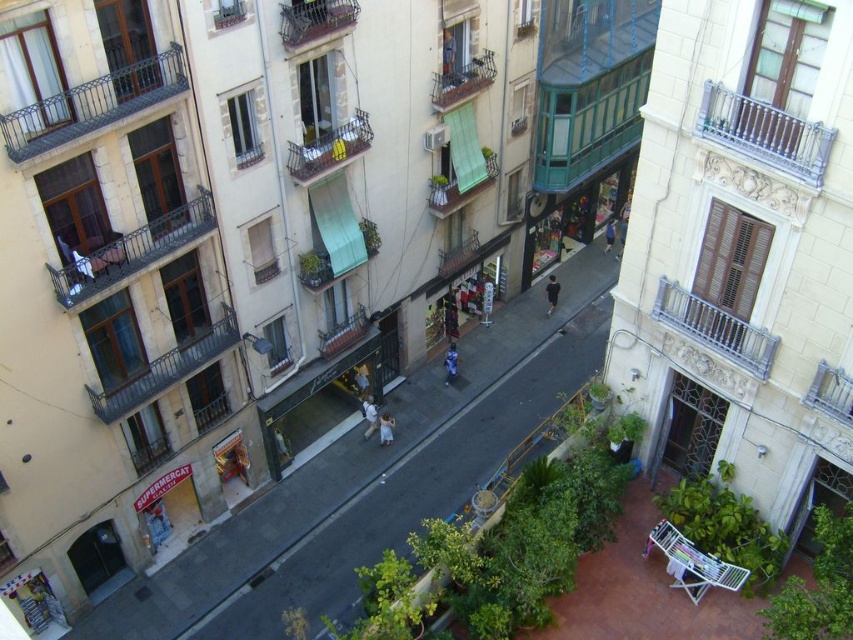
You are a tourist standing at the entrance of the SUPERMERCAT shop on the left side of the street. You notice a wooden brown balcony marked by point (x=165, y=371). In which direction relative to your current position is the wooden brown balcony located?

The wooden brown balcony at left is located to the left of your current position at the SUPERMERCAT shop entrance.

You are standing at the camera position looking at the urban street scene. There are two points marked in the image, one at coordinates point [367,406] and the other at point [612,220]. Which of these points is physically closer to you?

Point [367,406] is closer to the camera than point [612,220], so the point at coordinates point [367,406] is physically closer to you.

You are a delivery person trying to deliver a package to the metallic gray balcony at upper center. You are standing next to the light blue denim jeans at center. Can you place the package directly on the balcony without needing a ladder?

The metallic gray balcony at upper center is above the light blue denim jeans at center, so you can reach it without a ladder by placing the package directly since it is within reach from your current position.